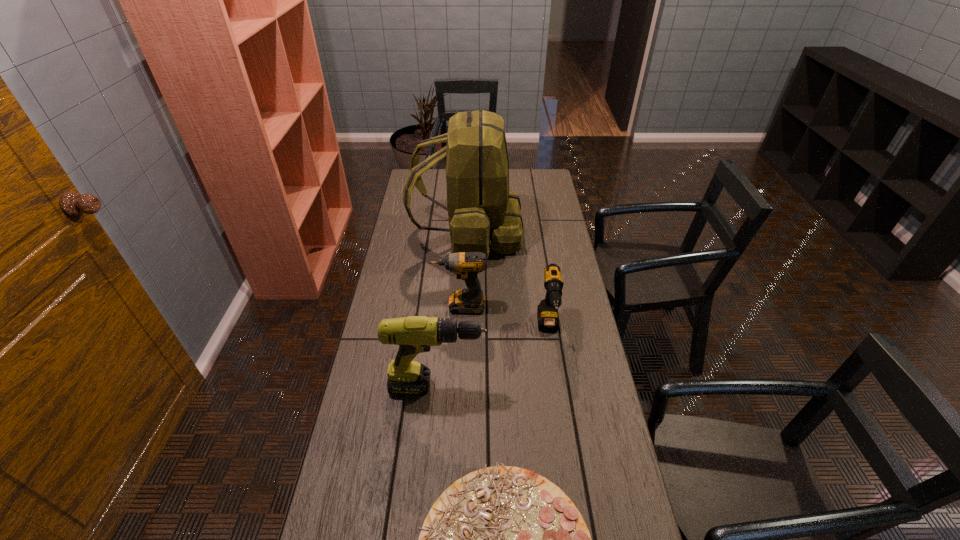
Identify which drill is the third nearest to the shortest object. Please provide its 2D coordinates. Your answer should be formatted as a tuple, i.e. [(x, y)], where the tuple contains the x and y coordinates of a point satisfying the conditions above.

[(466, 265)]

Locate which drill is the closest to the backpack. Please provide its 2D coordinates. Your answer should be formatted as a tuple, i.e. [(x, y)], where the tuple contains the x and y coordinates of a point satisfying the conditions above.

[(466, 265)]

The image size is (960, 540). In order to click on vacant space that satisfies the following two spatial constraints: 1. at the tip of the rightmost drill; 2. on the handle side of the tallest drill in this screenshot , I will do `click(557, 386)`.

Locate an element on the screen. This screenshot has height=540, width=960. vacant space that satisfies the following two spatial constraints: 1. at the tip of the rightmost drill; 2. on the handle side of the nearest drill is located at coordinates (557, 386).